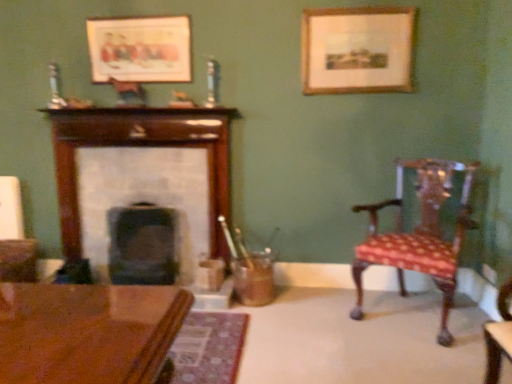
What is the approximate height of wooden fireplace at center, which is counted as the 2th fireplace, starting from the right?

wooden fireplace at center, which is counted as the 2th fireplace, starting from the right, is 4.21 feet in height.

The image size is (512, 384). What do you see at coordinates (420, 234) in the screenshot?
I see `polished wood chair at right` at bounding box center [420, 234].

Find the location of a particular element. wooden picture frame at upper right, which ranks as the 1th picture frame in right-to-left order is located at coordinates (357, 50).

Are wooden picture frame at upper center, placed as the second picture frame when sorted from right to left, and wooden picture frame at upper right, the 2th picture frame when ordered from left to right, making contact?

They are not placed beside each other.

Considering the positions of points (98, 43) and (303, 68), is point (98, 43) farther from camera compared to point (303, 68)?

That is True.

Which is more to the right, wooden picture frame at upper center, placed as the second picture frame when sorted from right to left, or wooden picture frame at upper right, the 2th picture frame when ordered from left to right?

wooden picture frame at upper right, the 2th picture frame when ordered from left to right, is more to the right.

Is wooden picture frame at upper center, marked as the 1th picture frame in a left-to-right arrangement, taller or shorter than wooden picture frame at upper right, which ranks as the 1th picture frame in right-to-left order?

Considering their sizes, wooden picture frame at upper center, marked as the 1th picture frame in a left-to-right arrangement, has less height than wooden picture frame at upper right, which ranks as the 1th picture frame in right-to-left order.

How distant is wooden fireplace at center, placed as the 1th fireplace when sorted from left to right, from smooth dark wood fireplace at center, the second fireplace from the left?

wooden fireplace at center, placed as the 1th fireplace when sorted from left to right, and smooth dark wood fireplace at center, the second fireplace from the left, are 10.97 inches apart.

Which of these two, wooden fireplace at center, placed as the 1th fireplace when sorted from left to right, or smooth dark wood fireplace at center, the second fireplace from the left, is wider?

With larger width is smooth dark wood fireplace at center, the second fireplace from the left.

Is point (77, 225) closer to viewer compared to point (135, 231)?

Yes, point (77, 225) is in front of point (135, 231).

Who is more distant, wooden fireplace at center, which is counted as the 2th fireplace, starting from the right, or smooth dark wood fireplace at center, the second fireplace from the left?

wooden fireplace at center, which is counted as the 2th fireplace, starting from the right, is behind.

Can we say wooden picture frame at upper right, the 2th picture frame when ordered from left to right, lies outside polished wood chair at right?

Yes, wooden picture frame at upper right, the 2th picture frame when ordered from left to right, is outside of polished wood chair at right.

Considering the sizes of wooden picture frame at upper right, which ranks as the 1th picture frame in right-to-left order, and polished wood chair at right in the image, is wooden picture frame at upper right, which ranks as the 1th picture frame in right-to-left order, wider or thinner than polished wood chair at right?

In the image, wooden picture frame at upper right, which ranks as the 1th picture frame in right-to-left order, appears to be more narrow than polished wood chair at right.

At what (x,y) coordinates should I click in order to perform the action: click on chair beneath the wooden picture frame at upper right, the 2th picture frame when ordered from left to right (from a real-world perspective). Please return your answer as a coordinate pair (x, y). Looking at the image, I should click on coord(420,234).

Does smooth dark wood fireplace at center, the second fireplace from the left, touch polished wood chair at right?

No, smooth dark wood fireplace at center, the second fireplace from the left, is not in contact with polished wood chair at right.

Based on the photo, is smooth dark wood fireplace at center, the second fireplace from the left, taller than polished wood chair at right?

In fact, smooth dark wood fireplace at center, the second fireplace from the left, may be shorter than polished wood chair at right.

How much distance is there between smooth dark wood fireplace at center, the first fireplace in the right-to-left sequence, and polished wood chair at right?

smooth dark wood fireplace at center, the first fireplace in the right-to-left sequence, and polished wood chair at right are 5.38 feet apart.

Which is behind, point (128, 270) or point (370, 253)?

Positioned behind is point (128, 270).

Can you confirm if wooden fireplace at center, placed as the 1th fireplace when sorted from left to right, is positioned to the left of wooden picture frame at upper center, placed as the second picture frame when sorted from right to left?

Yes.

How much distance is there between wooden fireplace at center, which is counted as the 2th fireplace, starting from the right, and wooden picture frame at upper center, marked as the 1th picture frame in a left-to-right arrangement?

They are 22.64 inches apart.

Is wooden fireplace at center, which is counted as the 2th fireplace, starting from the right, facing towards wooden picture frame at upper center, marked as the 1th picture frame in a left-to-right arrangement?

No, wooden fireplace at center, which is counted as the 2th fireplace, starting from the right, is not facing towards wooden picture frame at upper center, marked as the 1th picture frame in a left-to-right arrangement.

Is wooden fireplace at center, which is counted as the 2th fireplace, starting from the right, inside or outside of wooden picture frame at upper center, placed as the second picture frame when sorted from right to left?

wooden fireplace at center, which is counted as the 2th fireplace, starting from the right, is outside wooden picture frame at upper center, placed as the second picture frame when sorted from right to left.

Which is less distant, (184, 113) or (359, 53)?

Point (184, 113) is farther from the camera than point (359, 53).

Which of these two, wooden fireplace at center, which is counted as the 2th fireplace, starting from the right, or wooden picture frame at upper right, which ranks as the 1th picture frame in right-to-left order, is wider?

wooden fireplace at center, which is counted as the 2th fireplace, starting from the right.

Based on the photo, how distant is wooden fireplace at center, which is counted as the 2th fireplace, starting from the right, from wooden picture frame at upper right, the 2th picture frame when ordered from left to right?

A distance of 3.72 feet exists between wooden fireplace at center, which is counted as the 2th fireplace, starting from the right, and wooden picture frame at upper right, the 2th picture frame when ordered from left to right.

Does wooden fireplace at center, which is counted as the 2th fireplace, starting from the right, lie behind wooden picture frame at upper right, which ranks as the 1th picture frame in right-to-left order?

Yes, wooden fireplace at center, which is counted as the 2th fireplace, starting from the right, is further from the viewer.

Is point (416, 249) closer to camera compared to point (122, 276)?

Yes, it is in front of point (122, 276).

How different are the orientations of polished wood chair at right and smooth dark wood fireplace at center, the first fireplace in the right-to-left sequence, in degrees?

polished wood chair at right and smooth dark wood fireplace at center, the first fireplace in the right-to-left sequence, are facing 32.5 degrees away from each other.

Is polished wood chair at right positioned in front of smooth dark wood fireplace at center, the second fireplace from the left?

That is True.

Could smooth dark wood fireplace at center, the second fireplace from the left, be considered to be inside polished wood chair at right?

Actually, smooth dark wood fireplace at center, the second fireplace from the left, is outside polished wood chair at right.

Image resolution: width=512 pixels, height=384 pixels. What are the coordinates of `picture frame on the left of wooden picture frame at upper right, which ranks as the 1th picture frame in right-to-left order` in the screenshot? It's located at [x=140, y=49].

Find the location of a particular element. This screenshot has width=512, height=384. fireplace on the right side of wooden fireplace at center, which is counted as the 2th fireplace, starting from the right is located at coordinates (143, 245).

From the image, which object appears to be farther from wooden fireplace at center, placed as the 1th fireplace when sorted from left to right, wooden picture frame at upper right, which ranks as the 1th picture frame in right-to-left order, or wooden picture frame at upper center, marked as the 1th picture frame in a left-to-right arrangement?

wooden picture frame at upper right, which ranks as the 1th picture frame in right-to-left order, is positioned further to the anchor wooden fireplace at center, placed as the 1th fireplace when sorted from left to right.

When comparing their distances from wooden fireplace at center, which is counted as the 2th fireplace, starting from the right, does wooden picture frame at upper center, placed as the second picture frame when sorted from right to left, or wooden picture frame at upper right, which ranks as the 1th picture frame in right-to-left order, seem further?

wooden picture frame at upper right, which ranks as the 1th picture frame in right-to-left order, lies further to wooden fireplace at center, which is counted as the 2th fireplace, starting from the right, than the other object.

Which object lies further to the anchor point polished wood chair at right, smooth dark wood fireplace at center, the second fireplace from the left, or wooden picture frame at upper right, the 2th picture frame when ordered from left to right?

smooth dark wood fireplace at center, the second fireplace from the left, is positioned further to the anchor polished wood chair at right.

Looking at the image, which one is located closer to smooth dark wood fireplace at center, the first fireplace in the right-to-left sequence, wooden fireplace at center, placed as the 1th fireplace when sorted from left to right, or wooden picture frame at upper right, which ranks as the 1th picture frame in right-to-left order?

Among the two, wooden fireplace at center, placed as the 1th fireplace when sorted from left to right, is located nearer to smooth dark wood fireplace at center, the first fireplace in the right-to-left sequence.

In the scene shown: Looking at the image, which one is located closer to wooden picture frame at upper right, the 2th picture frame when ordered from left to right, wooden fireplace at center, which is counted as the 2th fireplace, starting from the right, or polished wood chair at right?

polished wood chair at right is positioned closer to the anchor wooden picture frame at upper right, the 2th picture frame when ordered from left to right.

Which object lies nearer to the anchor point wooden picture frame at upper right, which ranks as the 1th picture frame in right-to-left order, wooden fireplace at center, placed as the 1th fireplace when sorted from left to right, or wooden picture frame at upper center, placed as the second picture frame when sorted from right to left?

wooden fireplace at center, placed as the 1th fireplace when sorted from left to right, is positioned closer to the anchor wooden picture frame at upper right, which ranks as the 1th picture frame in right-to-left order.

From the picture: Which object lies further to the anchor point wooden picture frame at upper center, placed as the second picture frame when sorted from right to left, smooth dark wood fireplace at center, the first fireplace in the right-to-left sequence, or wooden fireplace at center, which is counted as the 2th fireplace, starting from the right?

smooth dark wood fireplace at center, the first fireplace in the right-to-left sequence, is further to wooden picture frame at upper center, placed as the second picture frame when sorted from right to left.

Considering their positions, is wooden picture frame at upper center, marked as the 1th picture frame in a left-to-right arrangement, positioned closer to polished wood chair at right than wooden fireplace at center, which is counted as the 2th fireplace, starting from the right?

Based on the image, wooden fireplace at center, which is counted as the 2th fireplace, starting from the right, appears to be nearer to polished wood chair at right.

This screenshot has height=384, width=512. I want to click on fireplace between wooden picture frame at upper center, marked as the 1th picture frame in a left-to-right arrangement, and smooth dark wood fireplace at center, the first fireplace in the right-to-left sequence, in the vertical direction, so click(142, 176).

Find the location of `picture frame between smooth dark wood fireplace at center, the first fireplace in the right-to-left sequence, and wooden picture frame at upper right, the 2th picture frame when ordered from left to right, from left to right`. picture frame between smooth dark wood fireplace at center, the first fireplace in the right-to-left sequence, and wooden picture frame at upper right, the 2th picture frame when ordered from left to right, from left to right is located at coordinates (140, 49).

Identify the location of fireplace between wooden fireplace at center, which is counted as the 2th fireplace, starting from the right, and polished wood chair at right, in the horizontal direction. Image resolution: width=512 pixels, height=384 pixels. (143, 245).

Locate an element on the screen. picture frame between wooden picture frame at upper center, marked as the 1th picture frame in a left-to-right arrangement, and polished wood chair at right is located at coordinates (357, 50).